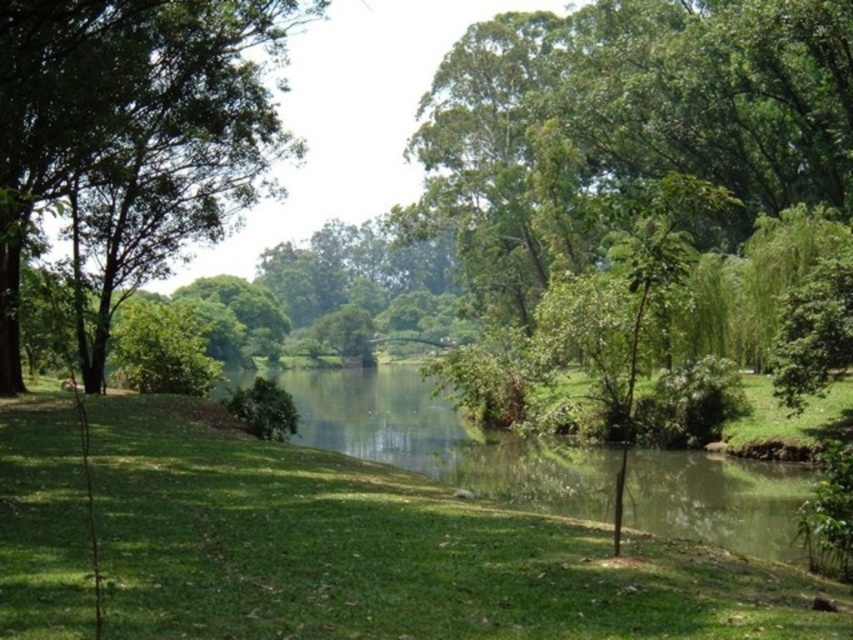
You are standing in the serene natural landscape and want to place a small flag at one of the two points. Which point, point (78, 621) or point (7, 24), is closer to you so you can reach it easily?

Point (78, 621) is closer to the camera than point (7, 24), so you can reach it easily.

You are standing on the green grassy at center and want to reach the green leafy tree at left. Which direction should you move to get closer to the tree?

To reach the green leafy tree at left from the green grassy at center, you should move upward since the green grassy at center is below the green leafy tree at left.